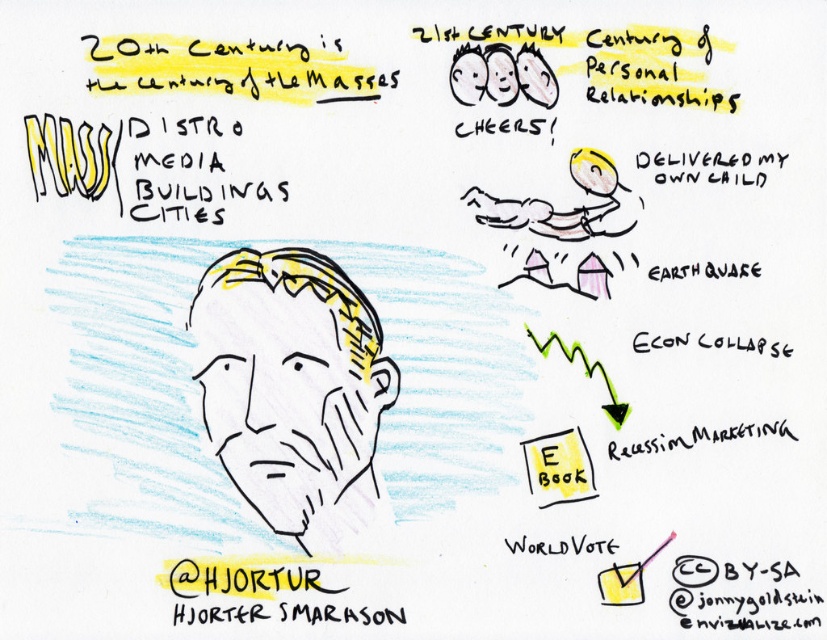
Question: Is black line drawing of a man at center to the right of blacktextured papercc by-sa logo at lower right from the viewer's perspective?

Choices:
 (A) yes
 (B) no

Answer: (B)

Question: Considering the real-world distances, which object is closest to the black handwritten text at lower center?

Choices:
 (A) black line drawing of a man at center
 (B) yellow paper e-book at center
 (C) blacktextured papercc by-sa logo at lower right

Answer: (B)

Question: Which of the following is the closest to the observer?

Choices:
 (A) (691, 621)
 (B) (222, 460)
 (C) (569, 444)

Answer: (A)

Question: Can you confirm if blacktextured papercc by-sa logo at lower right is wider than yellow paper e-book at center?

Choices:
 (A) no
 (B) yes

Answer: (B)

Question: In this image, where is yellow paper e-book at center located relative to black handwritten text at lower center?

Choices:
 (A) left
 (B) right

Answer: (A)

Question: Which object appears closest to the camera in this image?

Choices:
 (A) yellow paper e-book at center
 (B) black handwritten text at lower center
 (C) black line drawing of a man at center
 (D) blacktextured papercc by-sa logo at lower right

Answer: (D)